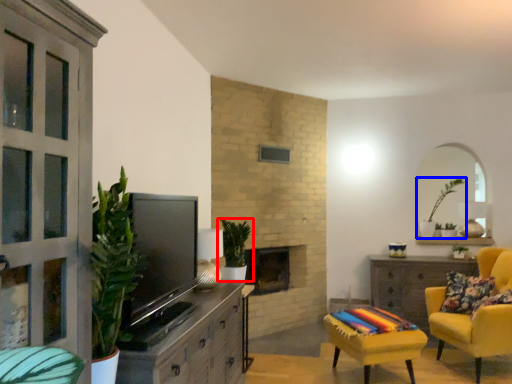
Question: Which object is closer to the camera taking this photo, houseplant (highlighted by a red box) or houseplant (highlighted by a blue box)?

Choices:
 (A) houseplant
 (B) houseplant

Answer: (A)